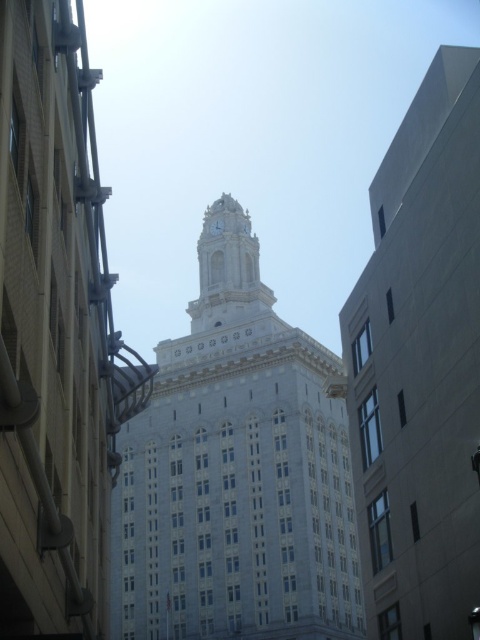
Question: Is white stone clock tower at center positioned at the back of white marble clock at center?

Choices:
 (A) no
 (B) yes

Answer: (A)

Question: In this image, where is white stone clock tower at center located relative to white marble clock at center?

Choices:
 (A) below
 (B) above

Answer: (A)

Question: Which object appears farthest from the camera in this image?

Choices:
 (A) white marble clock at center
 (B) white stone clock tower at center

Answer: (A)

Question: From the image, what is the correct spatial relationship of white stone clock tower at center in relation to white marble clock at center?

Choices:
 (A) below
 (B) above

Answer: (A)

Question: Which point is farther to the camera?

Choices:
 (A) white stone clock tower at center
 (B) white marble clock at center

Answer: (B)

Question: Which object appears closest to the camera in this image?

Choices:
 (A) white marble clock at center
 (B) white stone clock tower at center

Answer: (B)